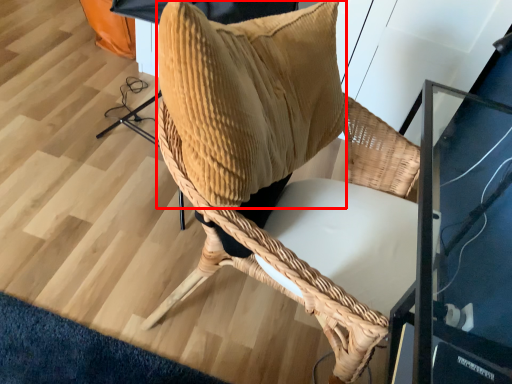
Question: In this image, where is pillow (annotated by the red box) located relative to chair?

Choices:
 (A) left
 (B) right

Answer: (A)